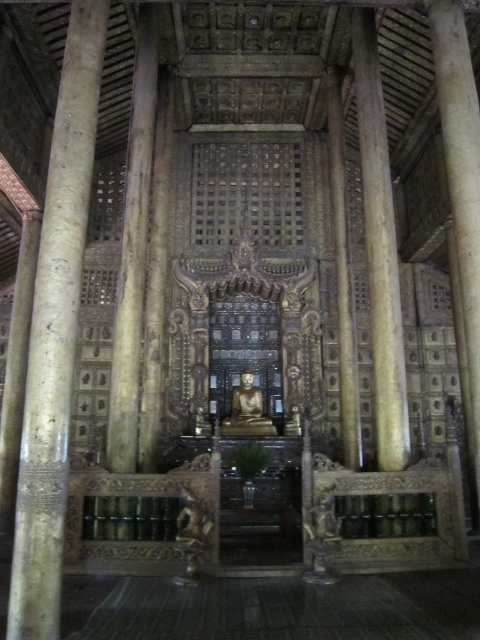
Question: Is wooden carved column at center wider than carved wood pillar at center?

Choices:
 (A) no
 (B) yes

Answer: (B)

Question: Which object is closer to the camera taking this photo?

Choices:
 (A) wooden carved column at center
 (B) carved wood pillar at center

Answer: (A)

Question: In this image, where is wooden carved column at center located relative to carved wood pillar at center?

Choices:
 (A) above
 (B) below

Answer: (B)

Question: Is wooden carved column at center wider than carved wood pillar at center?

Choices:
 (A) no
 (B) yes

Answer: (B)

Question: Which of the following is the closest to the observer?

Choices:
 (A) carved wood pillar at center
 (B) wooden carved column at center

Answer: (B)